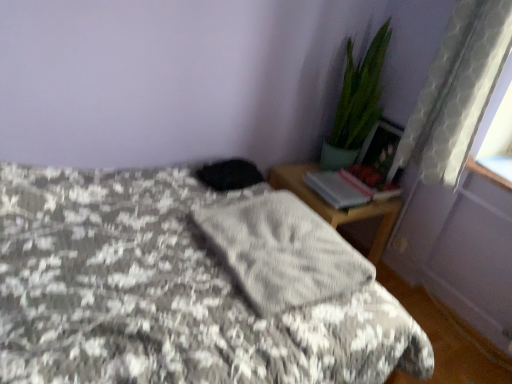
Question: Is wooden nightstand at right bigger or smaller than clear glass window sill at upper right?

Choices:
 (A) big
 (B) small

Answer: (A)

Question: Considering the positions of wooden nightstand at right and clear glass window sill at upper right in the image, is wooden nightstand at right wider or thinner than clear glass window sill at upper right?

Choices:
 (A) thin
 (B) wide

Answer: (B)

Question: Which is farther from the wooden nightstand at right?

Choices:
 (A) gray textured blanket at center
 (B) gray fabric at center
 (C) black matte pillow at center
 (D) green glossy plant at upper right
 (E) hardcover book at right

Answer: (A)

Question: Which object is the farthest from the clear glass window sill at upper right?

Choices:
 (A) gray fabric at center
 (B) white sheer curtain at right
 (C) black matte pillow at center
 (D) gray textured blanket at center
 (E) green glossy plant at upper right

Answer: (D)